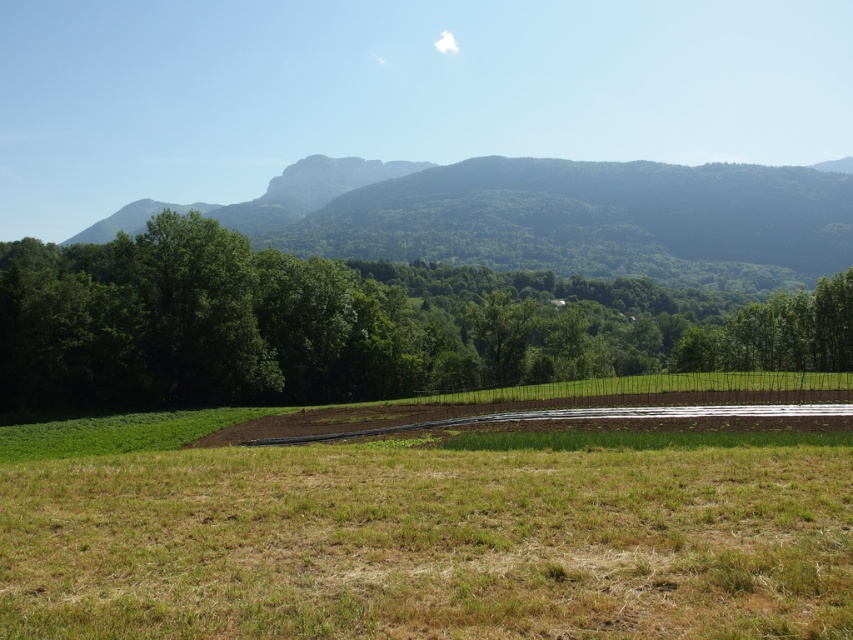
You are standing at the edge of the field and want to walk to the line of trees. Which direction should you head from the dry grass at center to reach the trees?

The line of trees is located beyond the field, so you should head away from the dry grass at center towards the distant wooded area to reach the trees.

You are standing at the camera position and see the dry grass at center. If you want to reach it without moving your feet, can you touch it with your outstretched hand?

The dry grass at center is 4.60 meters away from camera. Since the average human arm length is about 0.7 meters, you cannot reach it with your outstretched hand.

You are a farmer checking the growth of your crops. You notice the dry grass at center and the green leafy tree at center in your field. Which one is shorter?

The dry grass at center is shorter than the green leafy tree at center.